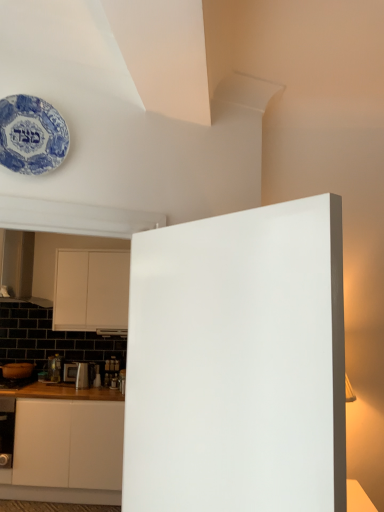
Question: Can you confirm if blue porcelain plate at upper left is taller than metallic silver toaster at lower left?

Choices:
 (A) yes
 (B) no

Answer: (A)

Question: Considering the relative positions of blue porcelain plate at upper left and metallic silver toaster at lower left in the image provided, is blue porcelain plate at upper left to the right of metallic silver toaster at lower left from the viewer's perspective?

Choices:
 (A) no
 (B) yes

Answer: (B)

Question: Considering the relative positions of blue porcelain plate at upper left and metallic silver toaster at lower left in the image provided, is blue porcelain plate at upper left to the left of metallic silver toaster at lower left from the viewer's perspective?

Choices:
 (A) no
 (B) yes

Answer: (A)

Question: Are blue porcelain plate at upper left and metallic silver toaster at lower left far apart?

Choices:
 (A) yes
 (B) no

Answer: (A)

Question: From a real-world perspective, is blue porcelain plate at upper left positioned under metallic silver toaster at lower left based on gravity?

Choices:
 (A) yes
 (B) no

Answer: (B)

Question: Is point (332, 332) positioned closer to the camera than point (74, 369)?

Choices:
 (A) farther
 (B) closer

Answer: (B)

Question: Considering the positions of white matte door at center and metallic silver toaster at lower left in the image, is white matte door at center wider or thinner than metallic silver toaster at lower left?

Choices:
 (A) wide
 (B) thin

Answer: (B)

Question: Is white matte door at center inside the boundaries of metallic silver toaster at lower left, or outside?

Choices:
 (A) outside
 (B) inside

Answer: (A)

Question: Is white matte door at center in front of or behind metallic silver toaster at lower left in the image?

Choices:
 (A) front
 (B) behind

Answer: (A)

Question: Is blue porcelain plate at upper left inside the boundaries of white matte door at center, or outside?

Choices:
 (A) outside
 (B) inside

Answer: (A)

Question: In the image, is blue porcelain plate at upper left positioned in front of or behind white matte door at center?

Choices:
 (A) behind
 (B) front

Answer: (A)

Question: Considering the positions of blue porcelain plate at upper left and white matte door at center in the image, is blue porcelain plate at upper left wider or thinner than white matte door at center?

Choices:
 (A) thin
 (B) wide

Answer: (A)

Question: Does point (3, 143) appear closer or farther from the camera than point (274, 417)?

Choices:
 (A) farther
 (B) closer

Answer: (A)

Question: From the image's perspective, relative to white matte cabinet at left, is metallic silver toaster at lower left above or below?

Choices:
 (A) above
 (B) below

Answer: (B)

Question: Looking at their shapes, would you say metallic silver toaster at lower left is wider or thinner than white matte cabinet at left?

Choices:
 (A) wide
 (B) thin

Answer: (B)